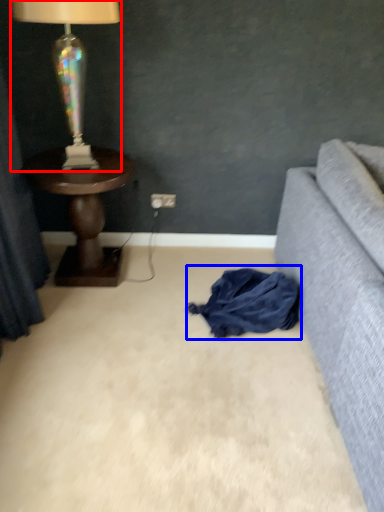
Question: Which of the following is the closest to the observer, lamp (highlighted by a red box) or clothing (highlighted by a blue box)?

Choices:
 (A) lamp
 (B) clothing

Answer: (A)